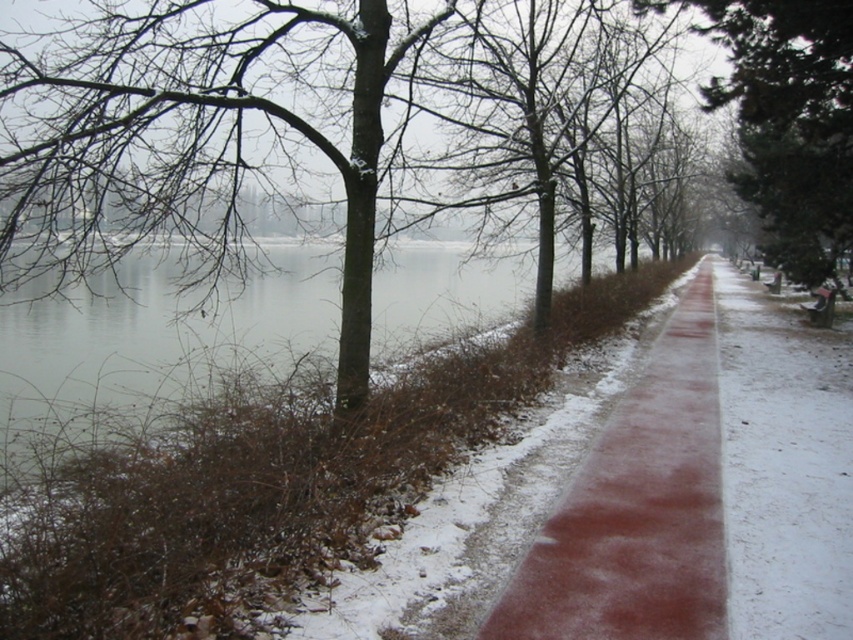
You are a hiker trying to decide which path to take. You see the sanded concrete path at center and the slick rubber path at center. Which path is closer to the left side of the scene?

The sanded concrete path at center is positioned on the left side of the slick rubber path at center, so it is closer to the left side of the scene.

You are standing at the starting point of the winter scene. You want to walk to the end of the slick rubber path at center. According to the coordinates given, in which direction should you move relative to your current position?

The slick rubber path at center is located at coordinates point (782, 465). Since the path is at the center, you should move forward along the path towards the coordinates to reach the end.